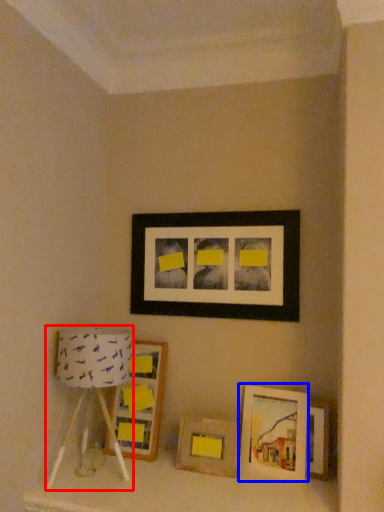
Question: Which object appears closest to the camera in this image, table lamp (highlighted by a red box) or picture frame (highlighted by a blue box)?

Choices:
 (A) table lamp
 (B) picture frame

Answer: (A)